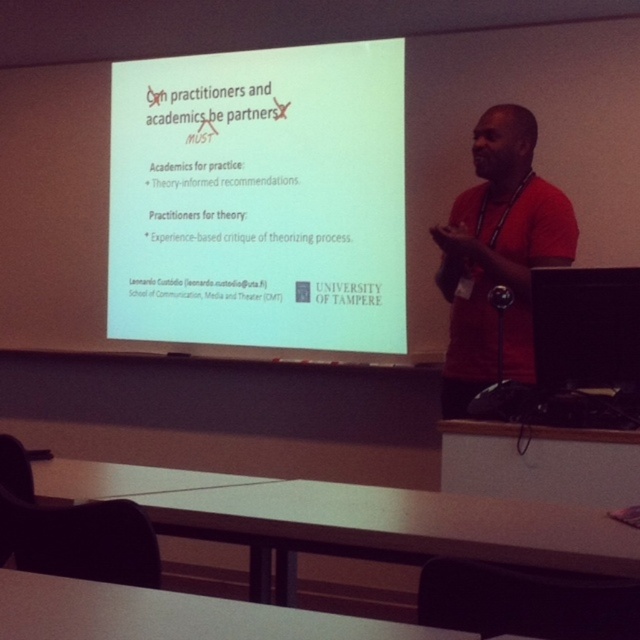
Question: Is white matte projector screen at upper center smaller than red matte shirt at right?

Choices:
 (A) yes
 (B) no

Answer: (B)

Question: Does white matte projector screen at upper center have a lesser width compared to red matte shirt at right?

Choices:
 (A) no
 (B) yes

Answer: (A)

Question: In this image, where is white matte projector screen at upper center located relative to red matte shirt at right?

Choices:
 (A) below
 (B) above

Answer: (B)